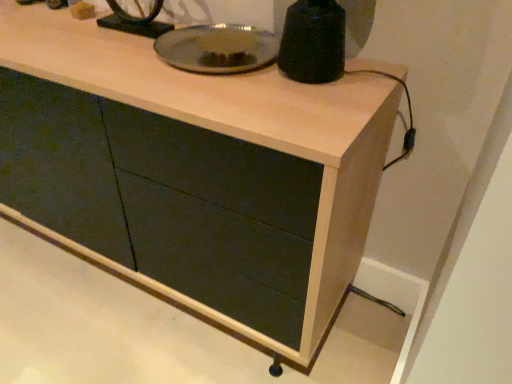
The image size is (512, 384). I want to click on vacant space underneath shiny glass plate at center (from a real-world perspective), so click(205, 59).